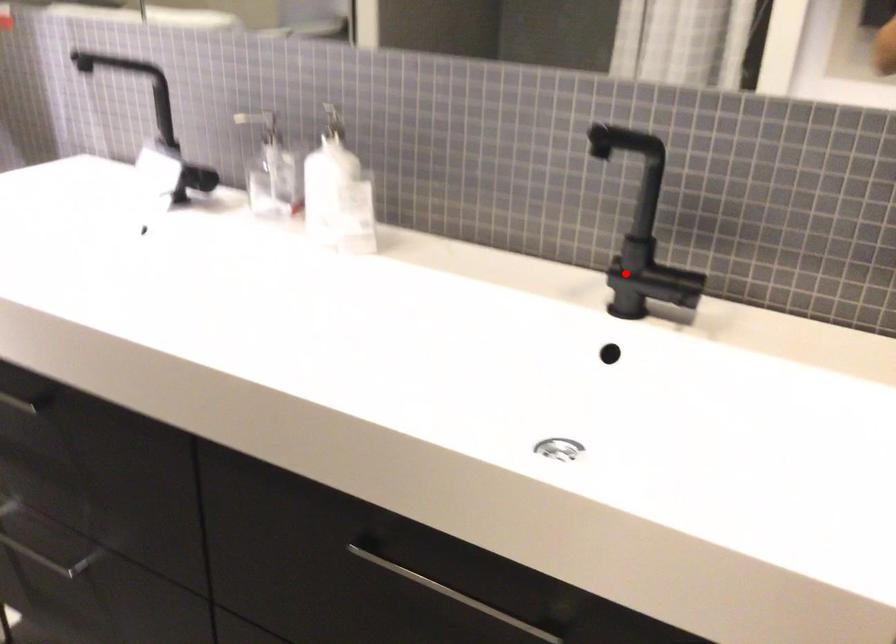
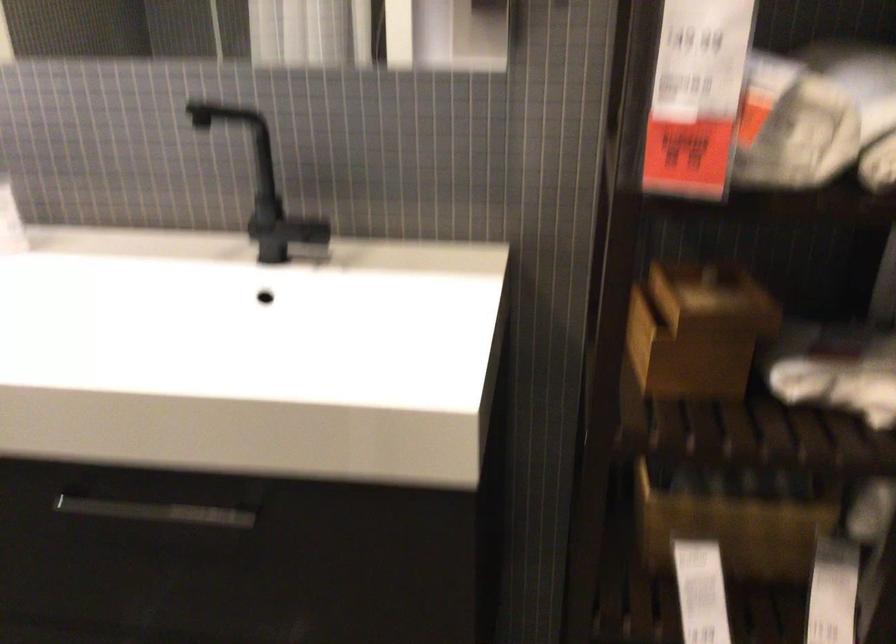
In the second image, find the point that corresponds to the highlighted location in the first image.

(268, 227)